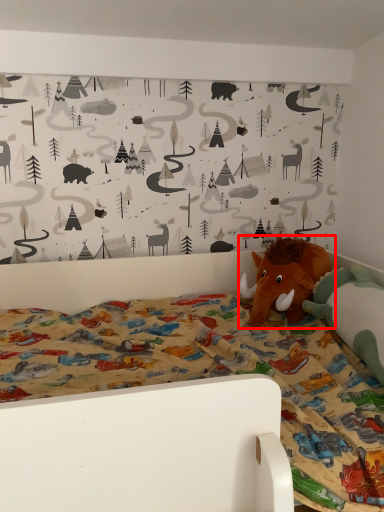
Question: From the image's perspective, what is the correct spatial positioning of toy (annotated by the red box) in reference to toy?

Choices:
 (A) below
 (B) above

Answer: (B)